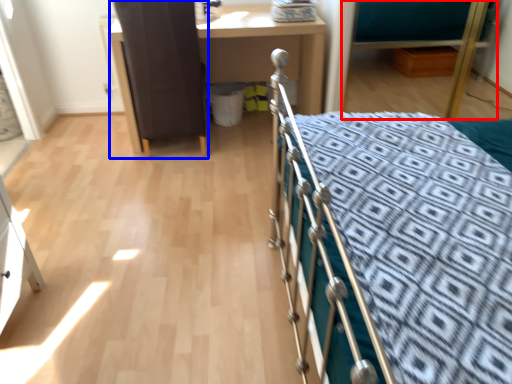
Question: Which of the following is the closest to the observer, hospital bed (highlighted by a red box) or screen door (highlighted by a blue box)?

Choices:
 (A) hospital bed
 (B) screen door

Answer: (B)